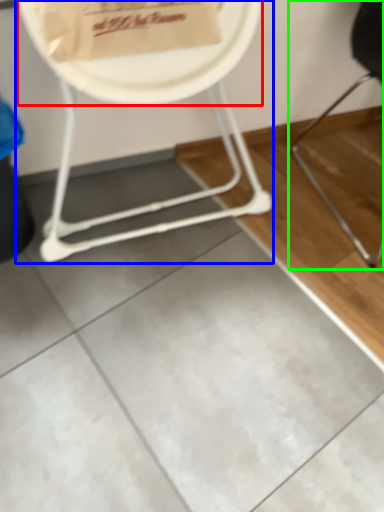
Question: Which object is the farthest from paper plate (highlighted by a red box)? Choose among these: chair (highlighted by a blue box) or chair (highlighted by a green box).

Choices:
 (A) chair
 (B) chair

Answer: (B)